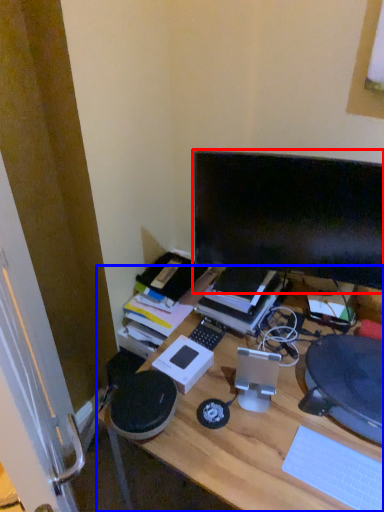
Question: Which point is closer to the camera, computer monitor (highlighted by a red box) or desk (highlighted by a blue box)?

Choices:
 (A) computer monitor
 (B) desk

Answer: (B)